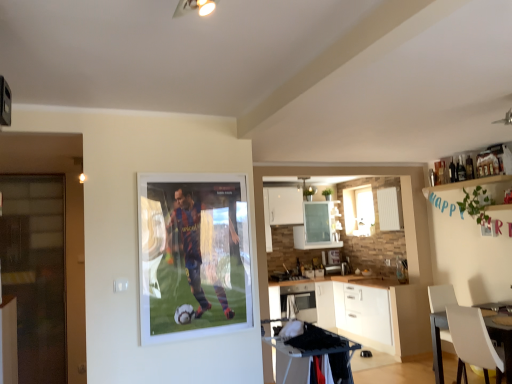
Question: Is transparent glass door at left to the left or to the right of white glossy cabinet at lower center in the image?

Choices:
 (A) right
 (B) left

Answer: (B)

Question: Choose the correct answer: Is transparent glass door at left inside white glossy cabinet at lower center or outside it?

Choices:
 (A) inside
 (B) outside

Answer: (B)

Question: Estimate the real-world distances between objects in this image. Which object is farther from the white glossy cabinet at lower center?

Choices:
 (A) transparent glass door at left
 (B) white glossy window at center
 (C) black plastic table at lower center
 (D) white plastic chair at lower right
 (E) white glossy microwave at center

Answer: (A)

Question: Estimate the real-world distances between objects in this image. Which object is farther from the white plastic chair at lower right?

Choices:
 (A) white glossy window at center
 (B) white glossy microwave at center
 (C) black plastic table at lower center
 (D) white glossy cabinet at lower center
 (E) transparent glass door at left

Answer: (E)